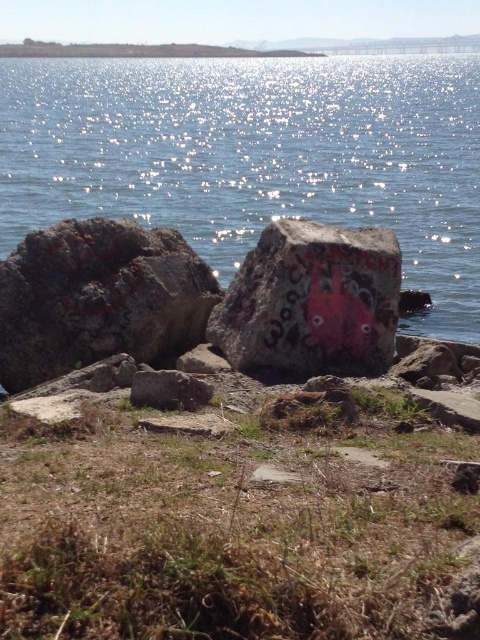
You are standing at the lakeside and want to place a small statue on the smooth gray rock at center so it can be seen from the glistening water at center. Is the statue visible from the water?

The glistening water at center is positioned on the right side of smooth gray rock at center, so placing the statue on the smooth gray rock at center would make it visible from the glistening water at center as they are adjacent to each other.

You are a hiker carrying a backpack and need to cross the lake. You see the rusty rock at left and the smooth gray rock at center. Which rock can you use as a stepping stone if your backpack adds 10 kg to your weight, and the maximum weight each rock can hold is 50 kg? Assume your weight plus the backpack is 60 kg.

The rusty rock at left is bigger than smooth gray rock at center, so it can support more weight. Since your total weight is 60 kg, which exceeds the 50 kg limit of the smooth gray rock at center, you should use the rusty rock at left as it can likely handle the load better.

You are a painter wanting to capture the scene. You have a canvas that can only fit objects up to the width of the smooth concrete boulder at center. Can you fit the glistening water at center on your canvas?

The glistening water at center has a larger width than the smooth concrete boulder at center, so it cannot fit on the canvas designed for the boulder.